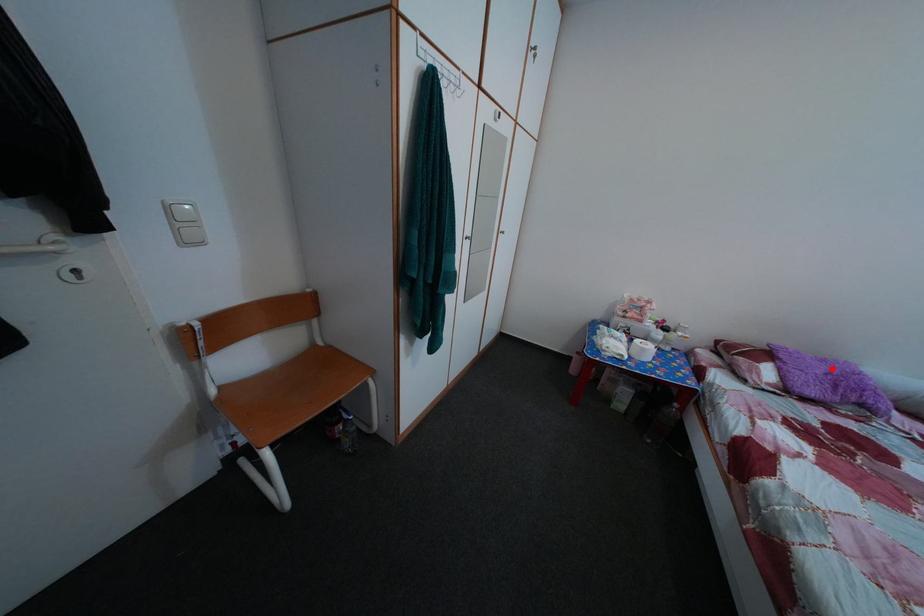
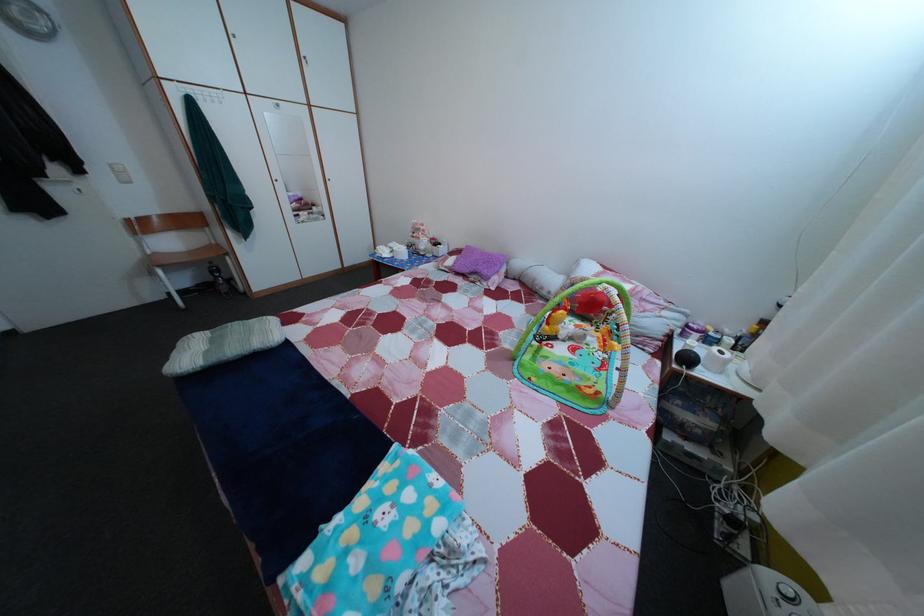
Question: A red point is marked in image1. In image2, is the corresponding 3D point closer to the camera or farther? Reply with the corresponding letter.

Choices:
 (A) The corresponding 3D point is closer.
 (B) The corresponding 3D point is farther.

Answer: (A)